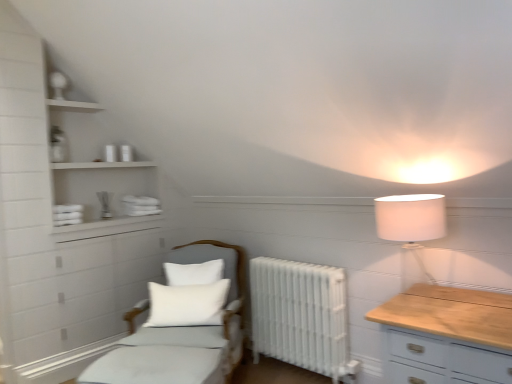
In order to face white matte shelves at upper left, should I rotate leftwards or rightwards?

Turn left approximately 20.133 degrees to face it.

Describe the element at coordinates (183, 323) in the screenshot. I see `light gray fabric chair at center` at that location.

Where is `white fabric lampshade at upper right`? The image size is (512, 384). white fabric lampshade at upper right is located at coordinates (411, 227).

What is the approximate width of white fabric bed at lower left?

white fabric bed at lower left is 21.63 inches wide.

I want to click on white fabric bed at lower left, so click(x=158, y=366).

Measure the distance between white soft cushion at center and camera.

The depth of white soft cushion at center is 2.74 meters.

In order to click on white soft cushion at center in this screenshot , I will do `click(187, 304)`.

Where is `white matte shelves at upper left`? white matte shelves at upper left is located at coordinates (95, 170).

From the image's perspective, which one is positioned higher, light gray fabric chair at center or white fabric bed at lower left?

From the image's view, light gray fabric chair at center is above.

Can white fabric bed at lower left be found inside light gray fabric chair at center?

No, white fabric bed at lower left is located outside of light gray fabric chair at center.

Between light gray fabric chair at center and white fabric bed at lower left, which one appears on the left side from the viewer's perspective?

From the viewer's perspective, white fabric bed at lower left appears more on the left side.

From the image's perspective, is light gray fabric chair at center above or below white soft cushion at center?

From the image's perspective, light gray fabric chair at center appears below white soft cushion at center.

Consider the image. Who is smaller, light gray fabric chair at center or white soft cushion at center?

white soft cushion at center.

This screenshot has height=384, width=512. Find the location of `furniture on the right of white soft cushion at center`. furniture on the right of white soft cushion at center is located at coordinates (183, 323).

Is there a large distance between light gray fabric chair at center and white soft cushion at center?

No.

From a real-world perspective, who is located higher, white metallic radiator at center or light gray fabric chair at center?

light gray fabric chair at center, from a real-world perspective.

Is white metallic radiator at center aimed at light gray fabric chair at center?

No, white metallic radiator at center is not turned towards light gray fabric chair at center.

In terms of width, does white metallic radiator at center look wider or thinner when compared to light gray fabric chair at center?

In the image, white metallic radiator at center appears to be more narrow than light gray fabric chair at center.

Is white metallic radiator at center bigger than light gray fabric chair at center?

No.

What's the angular difference between white metallic radiator at center and white soft cushion at center's facing directions?

The angular difference between white metallic radiator at center and white soft cushion at center is 35.3 degrees.

How much distance is there between white metallic radiator at center and white soft cushion at center?

white metallic radiator at center is 23.26 inches away from white soft cushion at center.

From a real-world perspective, which object rests below the other?

white metallic radiator at center.

Consider the image. Does white metallic radiator at center appear on the right side of white soft cushion at center?

Yes.

From the picture: Is white fabric bed at lower left aimed at light gray fabric chair at center?

No, white fabric bed at lower left is not facing towards light gray fabric chair at center.

Identify the location of bed frame in front of the light gray fabric chair at center. click(x=158, y=366).

Considering the positions of objects white fabric bed at lower left and light gray fabric chair at center in the image provided, who is behind, white fabric bed at lower left or light gray fabric chair at center?

Positioned behind is light gray fabric chair at center.

Considering the positions of points (213, 370) and (213, 372), is point (213, 370) farther from camera compared to point (213, 372)?

Yes, it is.

Considering the positions of objects white fabric lampshade at upper right and white matte shelves at upper left in the image provided, who is in front, white fabric lampshade at upper right or white matte shelves at upper left?

white fabric lampshade at upper right is closer to the camera.

From a real-world perspective, which is physically below, white fabric lampshade at upper right or white matte shelves at upper left?

In real-world perspective, white fabric lampshade at upper right is lower.

Which of these two, white fabric lampshade at upper right or white matte shelves at upper left, is bigger?

white matte shelves at upper left.

From the image's perspective, who appears lower, white fabric lampshade at upper right or white metallic radiator at center?

From the image's view, white metallic radiator at center is below.

Which object is further away from the camera taking this photo, white fabric lampshade at upper right or white metallic radiator at center?

white metallic radiator at center.

From a real-world perspective, who is located higher, white fabric lampshade at upper right or white metallic radiator at center?

white fabric lampshade at upper right, from a real-world perspective.

Considering the positions of objects white fabric lampshade at upper right and white metallic radiator at center in the image provided, who is more to the right, white fabric lampshade at upper right or white metallic radiator at center?

From the viewer's perspective, white fabric lampshade at upper right appears more on the right side.

At what (x,y) coordinates should I click in order to perform the action: click on bed frame that is below the light gray fabric chair at center (from the image's perspective). Please return your answer as a coordinate pair (x, y). The image size is (512, 384). Looking at the image, I should click on (158, 366).

Find the location of a particular element. The image size is (512, 384). furniture below the white soft cushion at center (from a real-world perspective) is located at coordinates tap(183, 323).

Considering their positions, is white soft cushion at center positioned closer to white metallic radiator at center than white matte shelves at upper left?

white soft cushion at center is positioned closer to the anchor white metallic radiator at center.

Which object lies further to the anchor point white soft cushion at center, light gray fabric chair at center or white matte shelves at upper left?

Based on the image, white matte shelves at upper left appears to be further to white soft cushion at center.

Looking at the image, which one is located closer to light gray fabric chair at center, white fabric bed at lower left or white soft cushion at center?

white soft cushion at center is closer to light gray fabric chair at center.

Which object lies nearer to the anchor point white soft cushion at center, white matte shelves at upper left or light gray fabric chair at center?

Based on the image, light gray fabric chair at center appears to be nearer to white soft cushion at center.

Looking at the image, which one is located closer to white matte shelves at upper left, white soft cushion at center or white metallic radiator at center?

white soft cushion at center lies closer to white matte shelves at upper left than the other object.

Looking at the image, which one is located further to white soft cushion at center, white fabric bed at lower left or white metallic radiator at center?

Among the two, white metallic radiator at center is located further to white soft cushion at center.

Based on their spatial positions, is white matte shelves at upper left or white metallic radiator at center closer to white fabric lampshade at upper right?

Among the two, white metallic radiator at center is located nearer to white fabric lampshade at upper right.

Considering their positions, is white metallic radiator at center positioned closer to light gray fabric chair at center than white soft cushion at center?

white soft cushion at center.

Find the location of a particular element. This screenshot has width=512, height=384. bed frame situated between white matte shelves at upper left and white metallic radiator at center from left to right is located at coordinates (158, 366).

Where is `furniture between white fabric bed at lower left and white fabric lampshade at upper right from left to right`? furniture between white fabric bed at lower left and white fabric lampshade at upper right from left to right is located at coordinates (183, 323).

The width and height of the screenshot is (512, 384). Find the location of `pillow between white fabric bed at lower left and white fabric lampshade at upper right from left to right`. pillow between white fabric bed at lower left and white fabric lampshade at upper right from left to right is located at coordinates (187, 304).

Where is `furniture between white soft cushion at center and white metallic radiator at center`? This screenshot has height=384, width=512. furniture between white soft cushion at center and white metallic radiator at center is located at coordinates (183, 323).